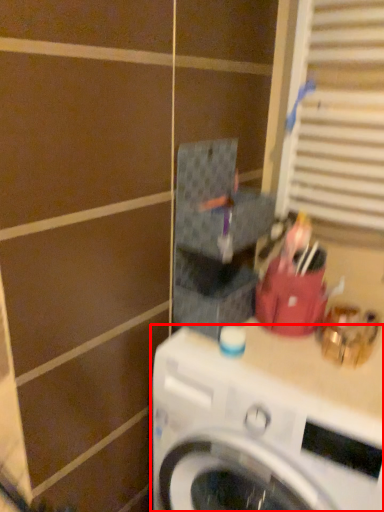
Question: From the image, what is the correct spatial relationship of washing machine (annotated by the red box) in relation to window?

Choices:
 (A) left
 (B) right

Answer: (A)